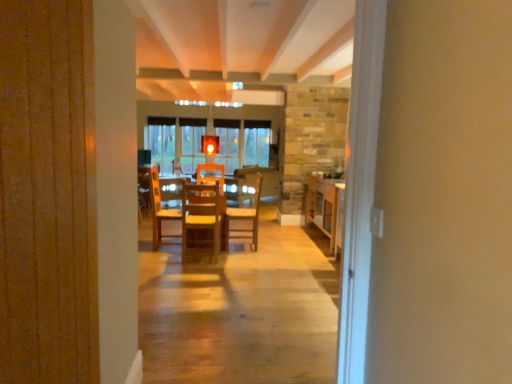
Question: Visually, is wooden table at right, which ranks as the 1th table in right-to-left order, positioned to the left or to the right of wooden chair at center, arranged as the second chair when viewed from the right?

Choices:
 (A) right
 (B) left

Answer: (A)

Question: Is wooden table at right, the second table viewed from the left, bigger or smaller than wooden chair at center, arranged as the second chair when viewed from the right?

Choices:
 (A) small
 (B) big

Answer: (B)

Question: Which of these objects is positioned farthest from the wooden table at center, arranged as the first table when viewed from the left?

Choices:
 (A) wooden table at right, which ranks as the 1th table in right-to-left order
 (B) wooden chair at center, which appears as the first chair when viewed from the back
 (C) wooden chair at center, positioned as the 1th chair in left-to-right order

Answer: (A)

Question: Which is nearer to the wooden table at center, the second table viewed from the right?

Choices:
 (A) wooden chair at center, which appears as the first chair when viewed from the right
 (B) wooden table at right, the second table viewed from the left
 (C) wooden chair at center, placed as the 2th chair when sorted from back to front

Answer: (C)